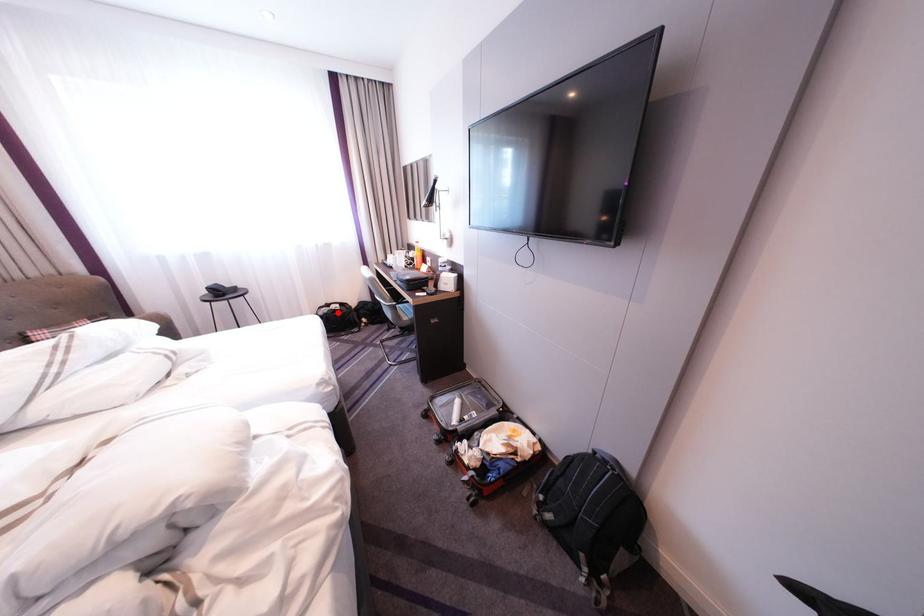
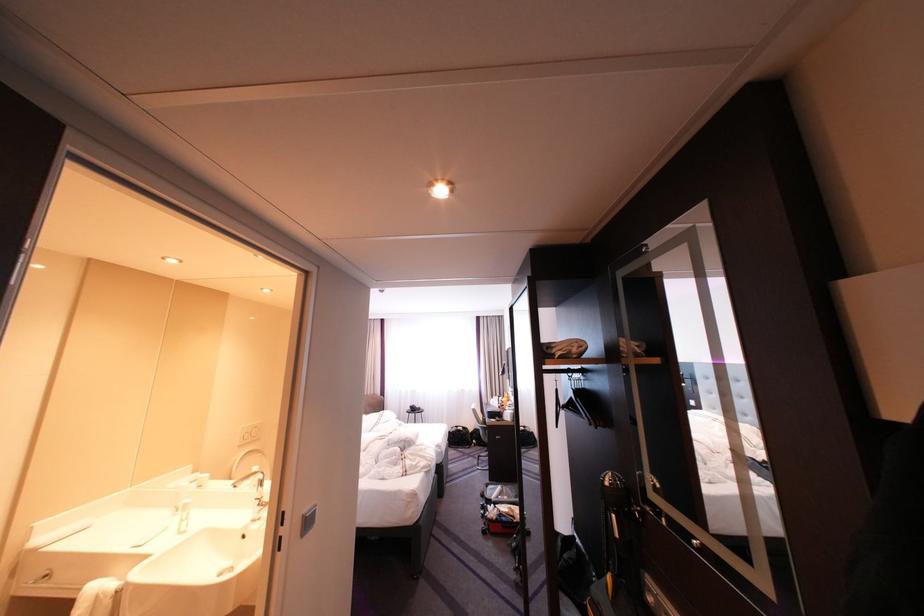
Question: I am providing you with two images of the same scene from different viewpoints. In image1, a red point is highlighted. Considering the same 3D point in image2, which of the following is correct?

Choices:
 (A) It is closer
 (B) It is farther

Answer: (B)